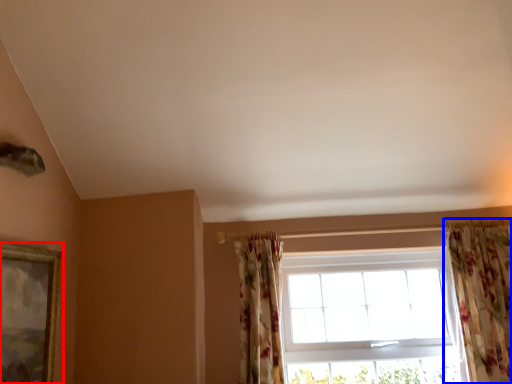
Question: Which object appears closest to the camera in this image, picture frame (highlighted by a red box) or curtain (highlighted by a blue box)?

Choices:
 (A) picture frame
 (B) curtain

Answer: (A)